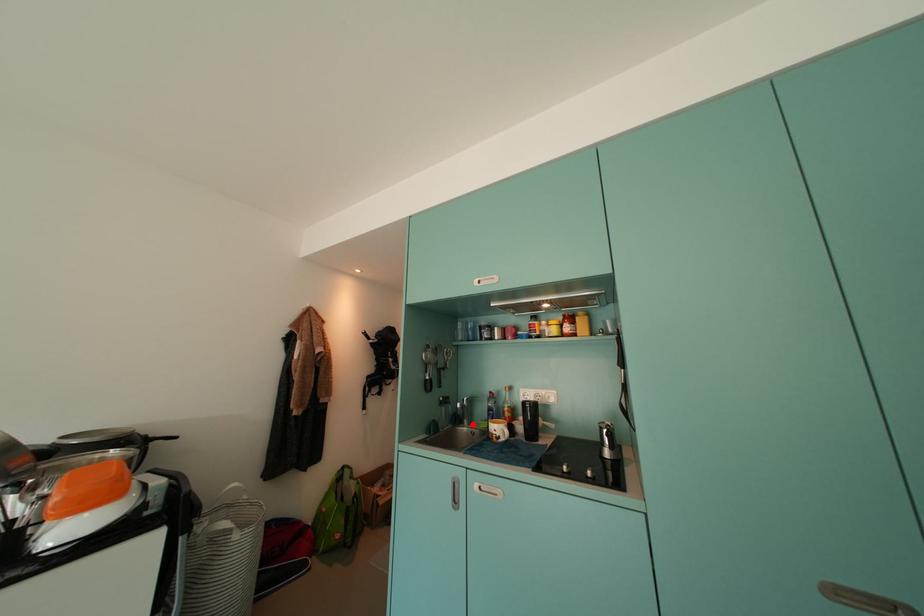
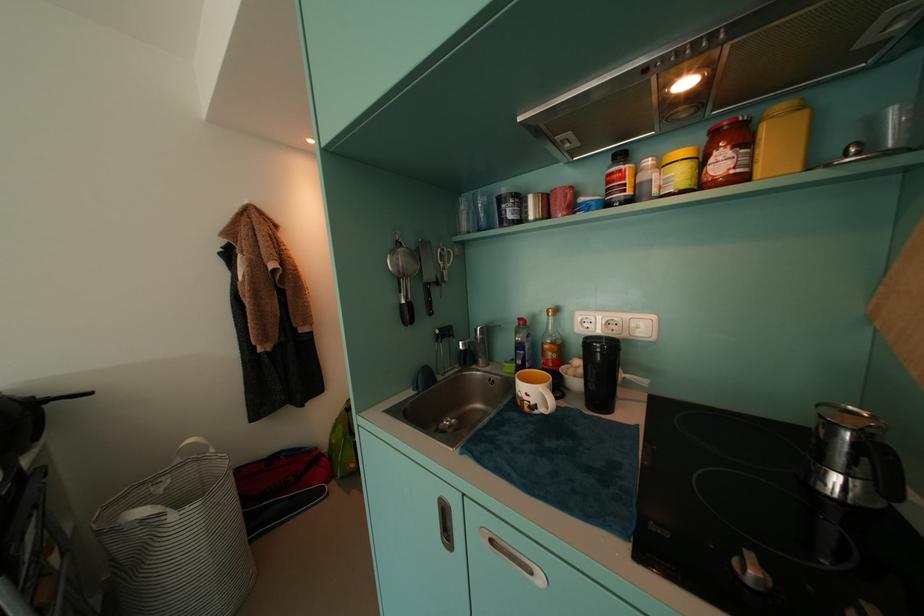
Find the pixel in the second image that matches the highlighted location in the first image.

(488, 363)